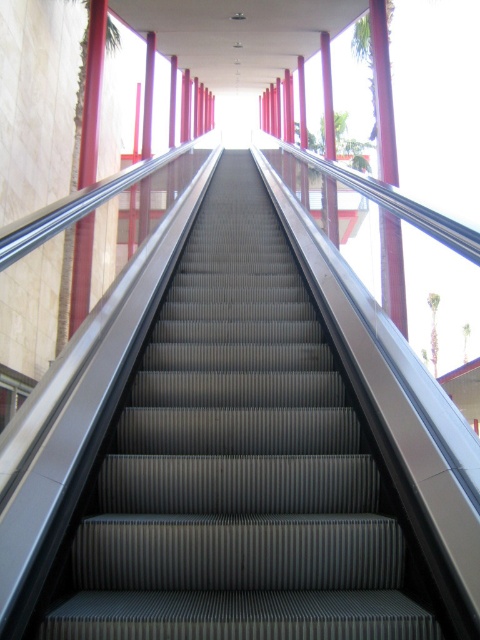
Question: Which of the following is the closest to the observer?

Choices:
 (A) (387, 628)
 (B) (384, 17)

Answer: (A)

Question: Observing the image, what is the correct spatial positioning of metallic gray escalator steps at center in reference to metallic red pillar at upper center?

Choices:
 (A) below
 (B) above

Answer: (A)

Question: Can you confirm if metallic gray escalator steps at center is positioned below metallic red pillar at upper center?

Choices:
 (A) no
 (B) yes

Answer: (B)

Question: Can you confirm if metallic gray escalator steps at center is bigger than metallic red pillar at upper center?

Choices:
 (A) no
 (B) yes

Answer: (A)